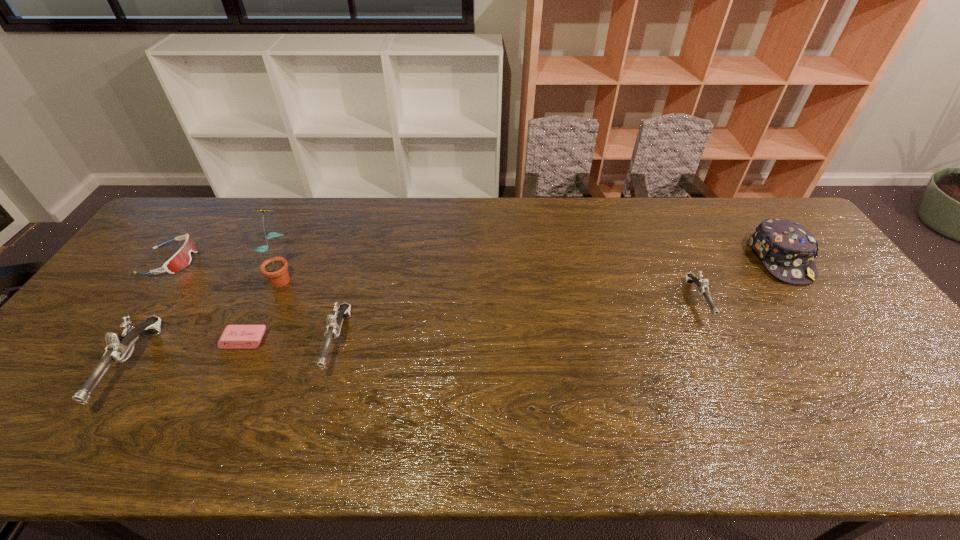
In the image, there is a desktop. What are the coordinates of `vacant area at the near edge` in the screenshot? It's located at (478, 397).

The image size is (960, 540). In the image, there is a desktop. Find the location of `free space at the left edge`. free space at the left edge is located at coordinates (99, 361).

The width and height of the screenshot is (960, 540). I want to click on vacant space at the right edge of the desktop, so click(872, 345).

Find the location of a particular element. The width and height of the screenshot is (960, 540). blank space at the near left corner of the desktop is located at coordinates (41, 407).

At what (x,y) coordinates should I click in order to perform the action: click on free spot between the third object from right to left and the tallest gun. Please return your answer as a coordinate pair (x, y). Looking at the image, I should click on (235, 355).

Where is `unoccupied area between the rightmost object and the eraser`? unoccupied area between the rightmost object and the eraser is located at coordinates (513, 300).

At what (x,y) coordinates should I click in order to perform the action: click on free space between the headwear and the eraser. Please return your answer as a coordinate pair (x, y). The image size is (960, 540). Looking at the image, I should click on (513, 300).

Locate an element on the screen. This screenshot has width=960, height=540. vacant point located between the goggles and the tallest object is located at coordinates (227, 268).

Locate an element on the screen. The width and height of the screenshot is (960, 540). free space between the shortest object and the shortest gun is located at coordinates (471, 321).

In order to click on unoccupied area between the eraser and the shortest gun in this screenshot , I will do `click(471, 321)`.